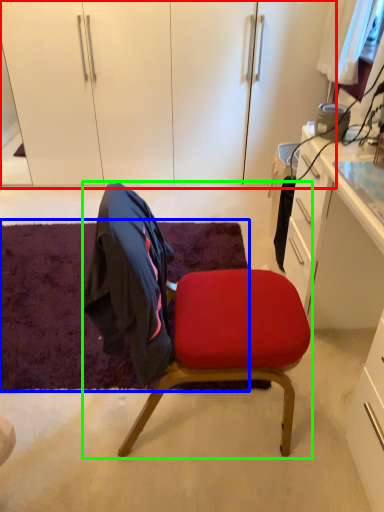
Question: Which object is positioned closest to dresser (highlighted by a red box)? Select from mat (highlighted by a blue box) and chair (highlighted by a green box).

Choices:
 (A) mat
 (B) chair

Answer: (A)